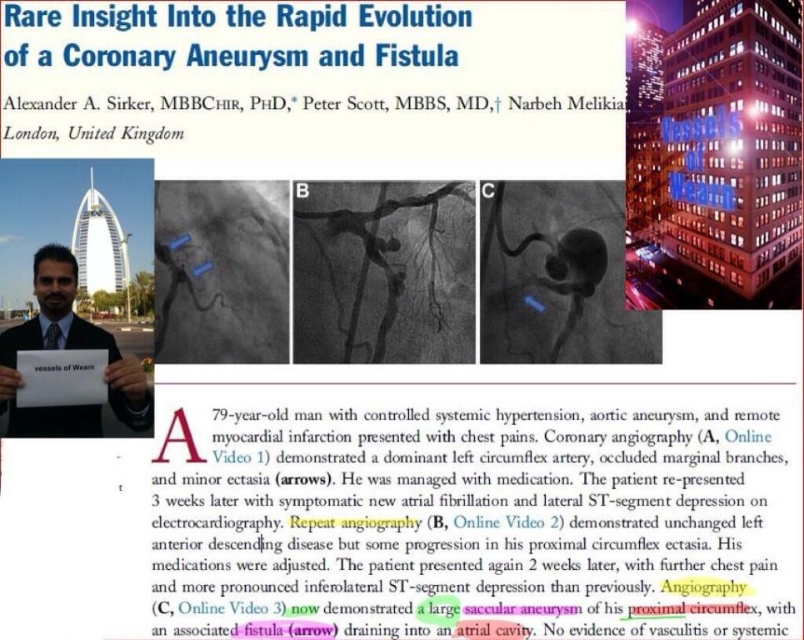
Which of these two, yellow highlighted text at center or matte black suit at center, stands taller?

With more height is yellow highlighted text at center.

Who is more forward, (411, 424) or (44, 324)?

Point (44, 324) is in front.

Where is `yellow highlighted text at center`? The width and height of the screenshot is (804, 640). yellow highlighted text at center is located at coordinates (478, 524).